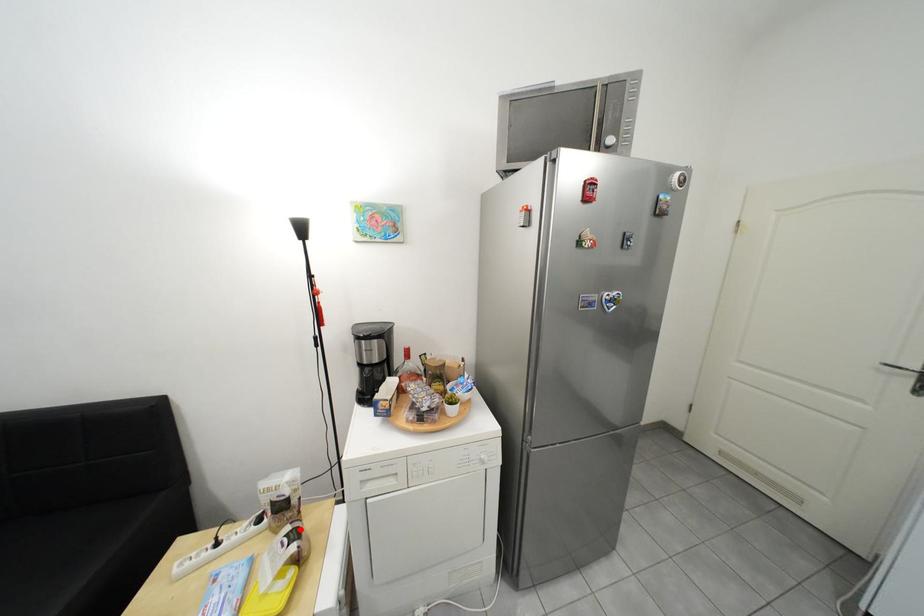
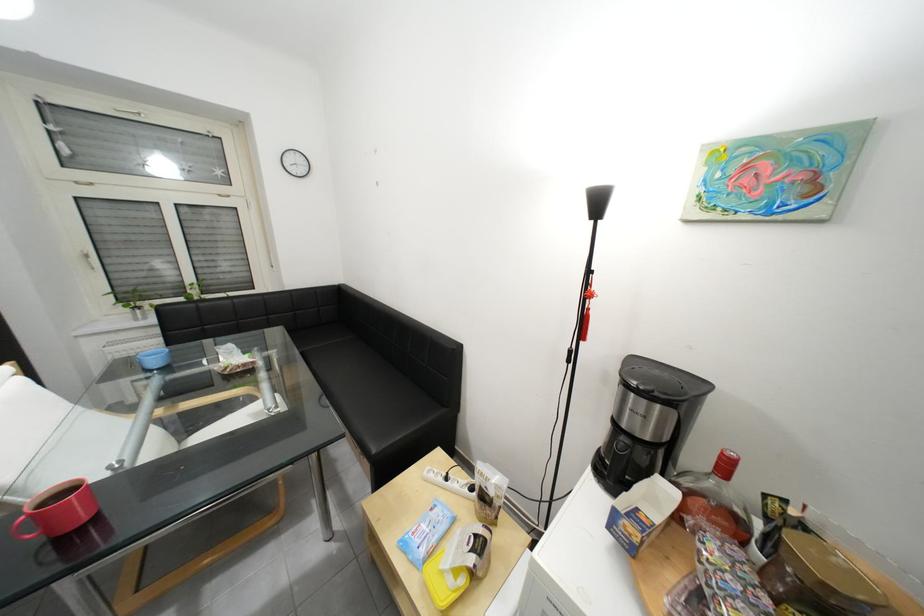
Locate, in the second image, the point that corresponds to the highlighted location in the first image.

(492, 531)